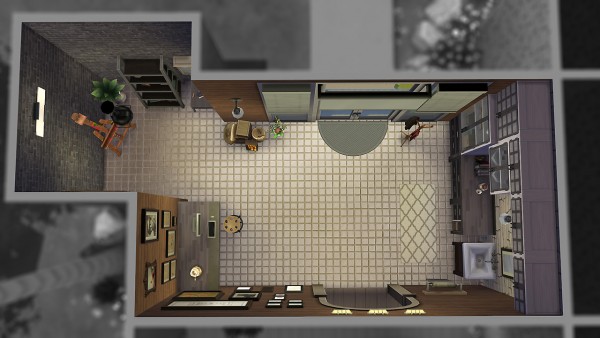
Locate an element on the screen. counter is located at coordinates (184, 267).